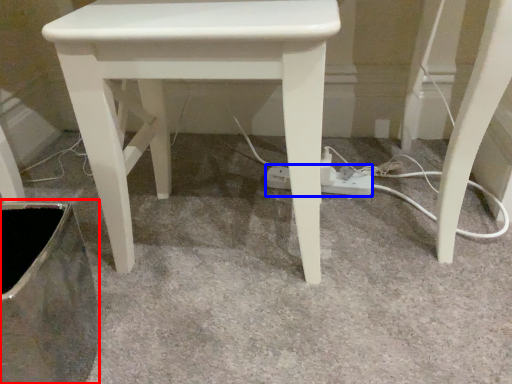
Question: Among these objects, which one is nearest to the camera, swivel chair (highlighted by a red box) or extension cord (highlighted by a blue box)?

Choices:
 (A) swivel chair
 (B) extension cord

Answer: (A)